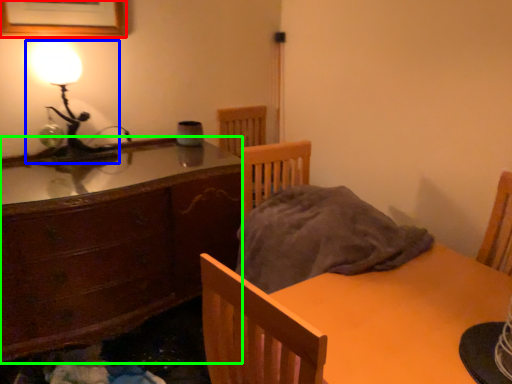
Question: Considering the real-world distances, which object is farthest from picture frame (highlighted by a red box)? lamp (highlighted by a blue box) or cabinetry (highlighted by a green box)?

Choices:
 (A) lamp
 (B) cabinetry

Answer: (B)